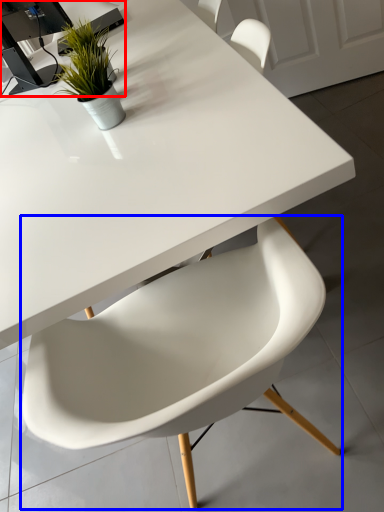
Question: Among these objects, which one is farthest to the camera, computer desk (highlighted by a red box) or chair (highlighted by a blue box)?

Choices:
 (A) computer desk
 (B) chair

Answer: (A)